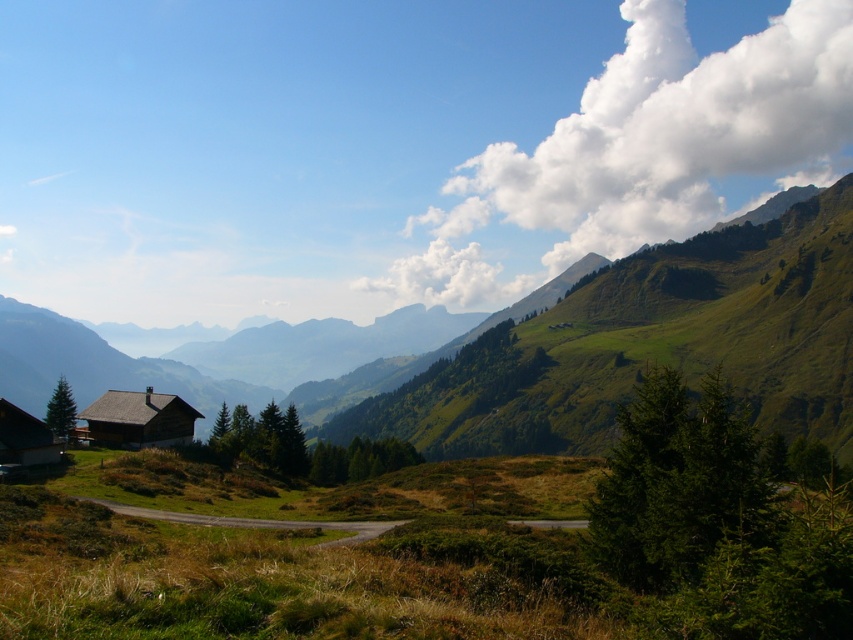
Does point (96, 438) come in front of point (47, 432)?

No, (96, 438) is further to viewer.

Can you confirm if wooden cabin at center is positioned to the left of wooden cabin at lower left?

In fact, wooden cabin at center is to the right of wooden cabin at lower left.

Where is `wooden cabin at center`? Image resolution: width=853 pixels, height=640 pixels. wooden cabin at center is located at coordinates (138, 419).